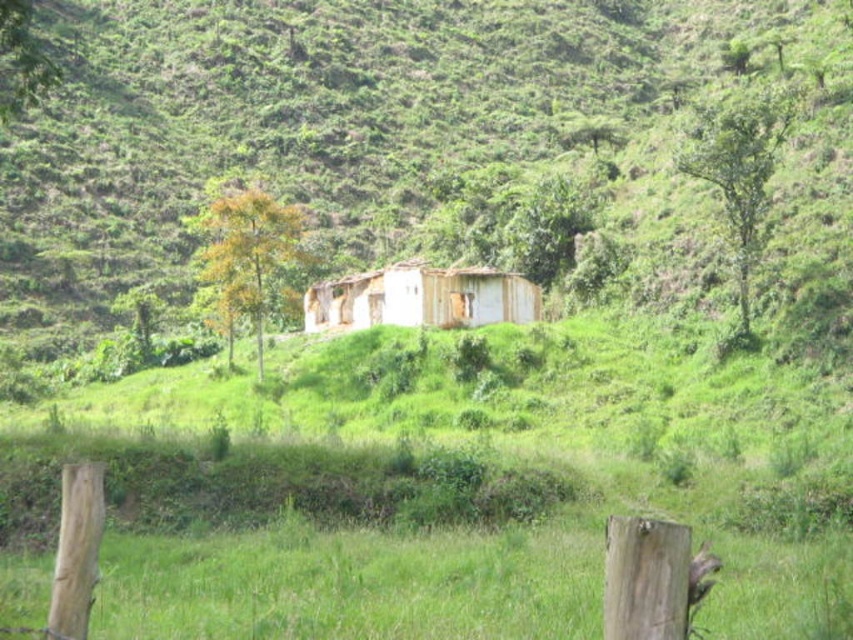
Between rusty metal shack at center and white wooden hut at center, which one is positioned lower?

white wooden hut at center

Can you confirm if rusty metal shack at center is bigger than white wooden hut at center?

Yes.

Who is more distant from viewer, (328, 45) or (399, 310)?

Positioned behind is point (328, 45).

Find the location of a particular element. rusty metal shack at center is located at coordinates [x=312, y=116].